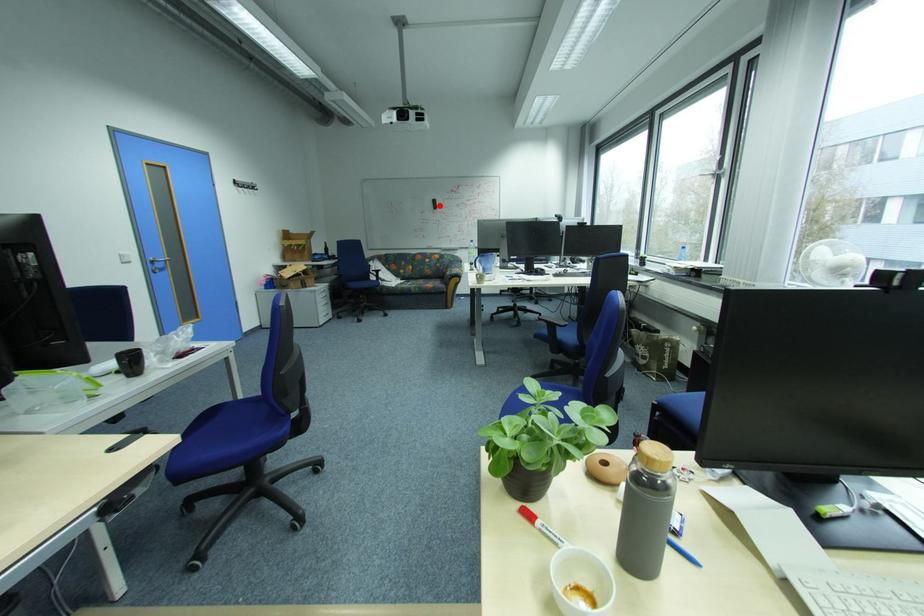
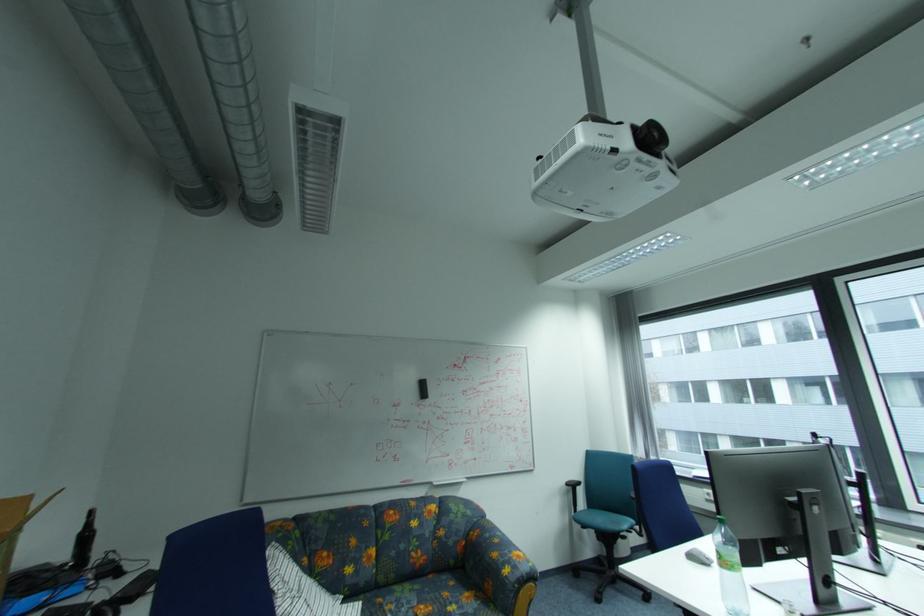
Question: A red point is marked in image1. In image2, is the corresponding 3D point closer to the camera or farther? Reply with the corresponding letter.

Choices:
 (A) The corresponding 3D point is closer.
 (B) The corresponding 3D point is farther.

Answer: (B)